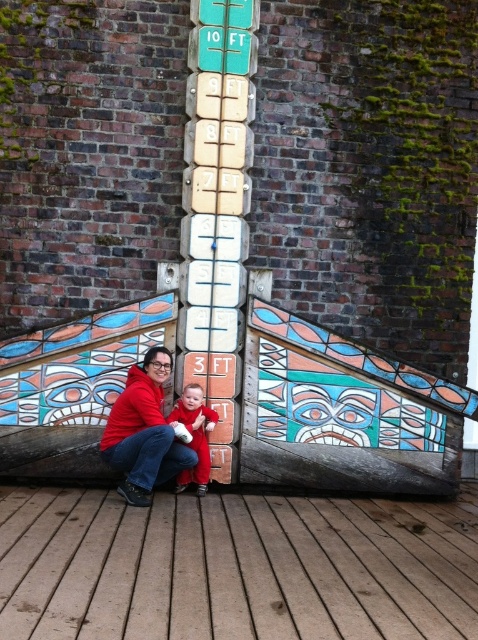
Who is more forward, (151, 413) or (201, 488)?

Positioned in front is point (151, 413).

Who is positioned more to the right, red hoodie at lower center or matte red onesie at center?

Positioned to the right is matte red onesie at center.

I want to click on red hoodie at lower center, so click(143, 432).